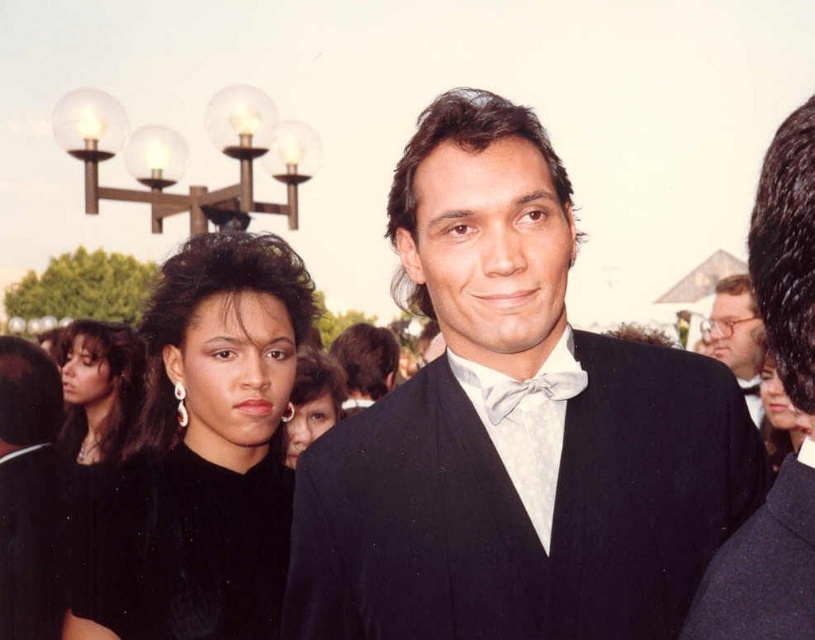
Is black matte dress at left thinner than white satin bow tie at center?

Incorrect, black matte dress at left's width is not less than white satin bow tie at center's.

Which is behind, point (240, 636) or point (547, 385)?

The point (240, 636) is behind.

Is point (221, 480) farther from camera compared to point (500, 422)?

Yes, it is behind point (500, 422).

Find the location of `black matte dress at left`. black matte dress at left is located at coordinates (205, 452).

Is black satin suit at center smaller than shiny black suit at center?

No, black satin suit at center is not smaller than shiny black suit at center.

Is point (482, 92) less distant than point (765, 200)?

No, (482, 92) is further to viewer.

Measure the distance between point [408,216] and camera.

They are 3.41 meters apart.

Find the location of a particular element. black satin suit at center is located at coordinates (513, 432).

Who is higher up, matte black dress at center or smooth black dress at center?

Positioned higher is smooth black dress at center.

Which is in front, point (76, 460) or point (761, 371)?

Positioned in front is point (761, 371).

The image size is (815, 640). Identify the location of matte black dress at center. (99, 388).